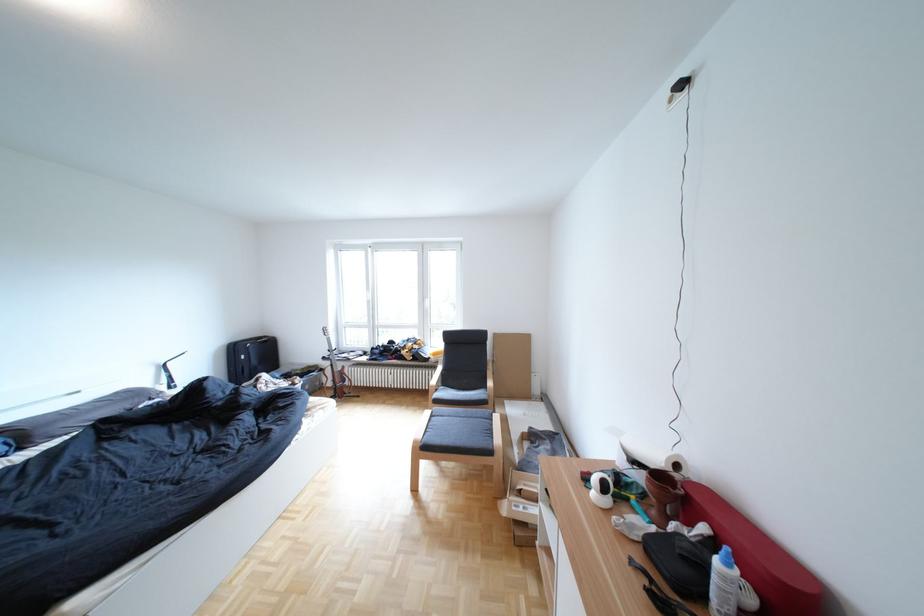
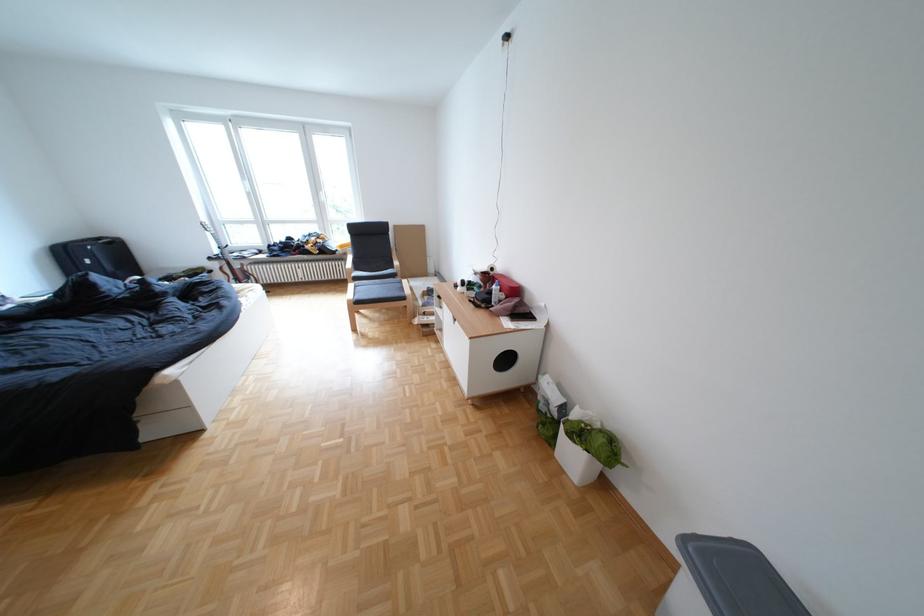
Find the pixel in the second image that matches point 699,557 in the first image.

(503, 294)